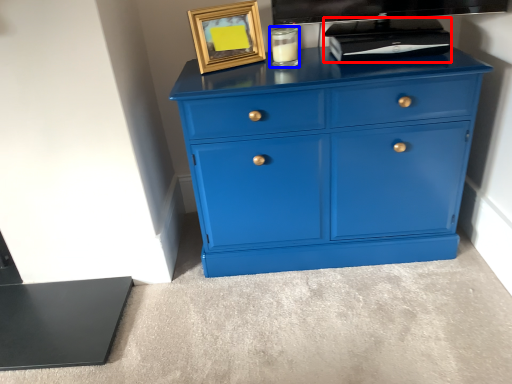
Question: Which object appears closest to the camera in this image, appliance (highlighted by a red box) or candle holder (highlighted by a blue box)?

Choices:
 (A) appliance
 (B) candle holder

Answer: (A)